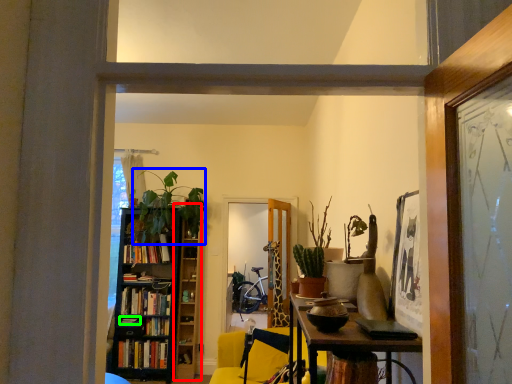
Question: Considering the real-world distances, which object is farthest from bookshelf (highlighted by a red box)? plant (highlighted by a blue box) or book (highlighted by a green box)?

Choices:
 (A) plant
 (B) book

Answer: (B)